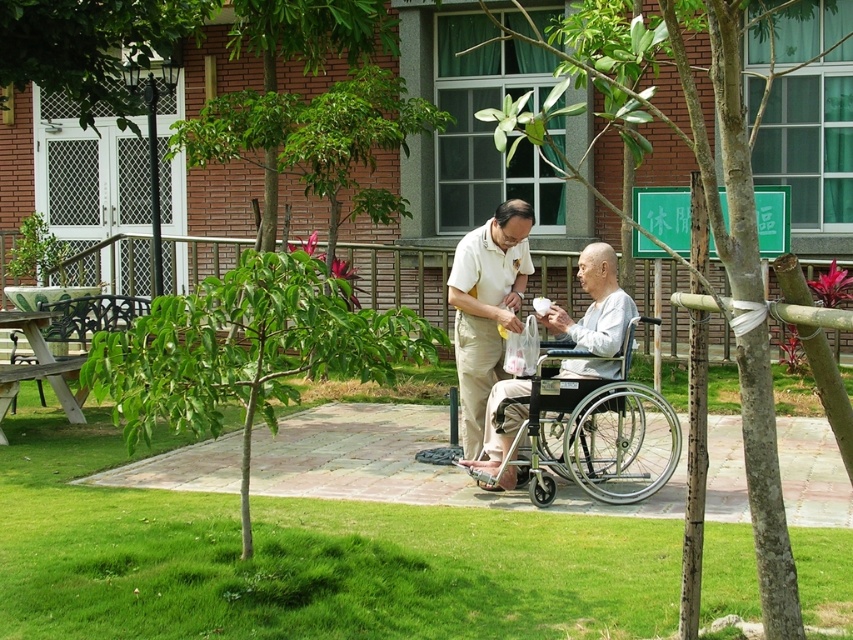
Can you confirm if green leafy tree at center is positioned to the left of silver metallic wheelchair at lower center?

Correct, you'll find green leafy tree at center to the left of silver metallic wheelchair at lower center.

Is green leafy tree at center positioned before silver metallic wheelchair at lower center?

Yes, it is in front of silver metallic wheelchair at lower center.

I want to click on green leafy tree at center, so click(718, 252).

Find the location of `green leafy tree at center`. green leafy tree at center is located at coordinates (718, 252).

Does green leafy tree at center appear on the right side of white matte shirt at center?

Correct, you'll find green leafy tree at center to the right of white matte shirt at center.

Locate an element on the screen. The image size is (853, 640). green leafy tree at center is located at coordinates (718, 252).

The height and width of the screenshot is (640, 853). Identify the location of green leafy tree at center. (718, 252).

Between point (521, 412) and point (508, 300), which one is positioned behind?

Positioned behind is point (508, 300).

Is silver metallic wheelchair at lower center positioned before white matte shirt at center?

That is True.

I want to click on silver metallic wheelchair at lower center, so click(x=589, y=429).